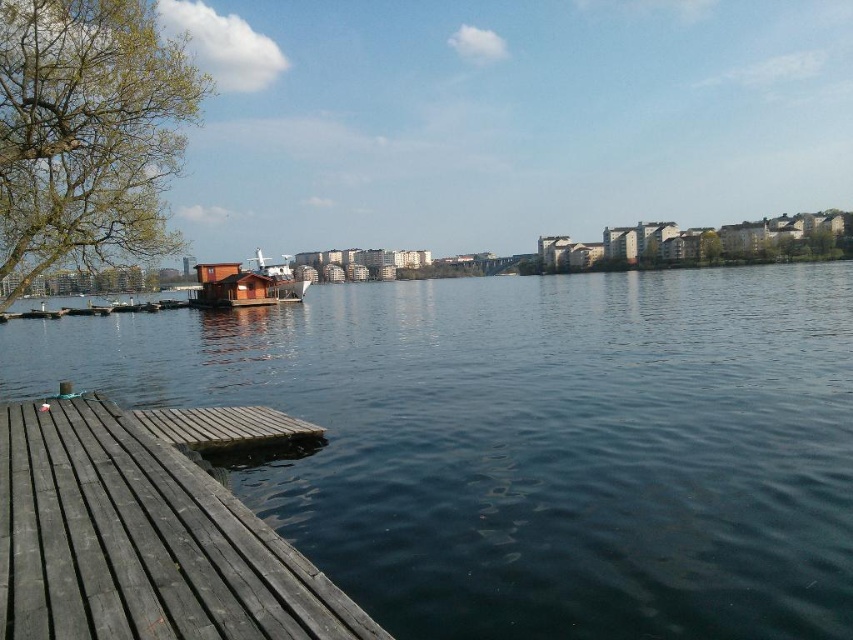
You are standing at the edge of the lake and want to reach the point closer to the camera between the two points, point (341, 540) and point (80, 600). Which point should you head towards?

You should head towards point (80, 600) because it is closer to the camera compared to point (341, 540), which is further away.